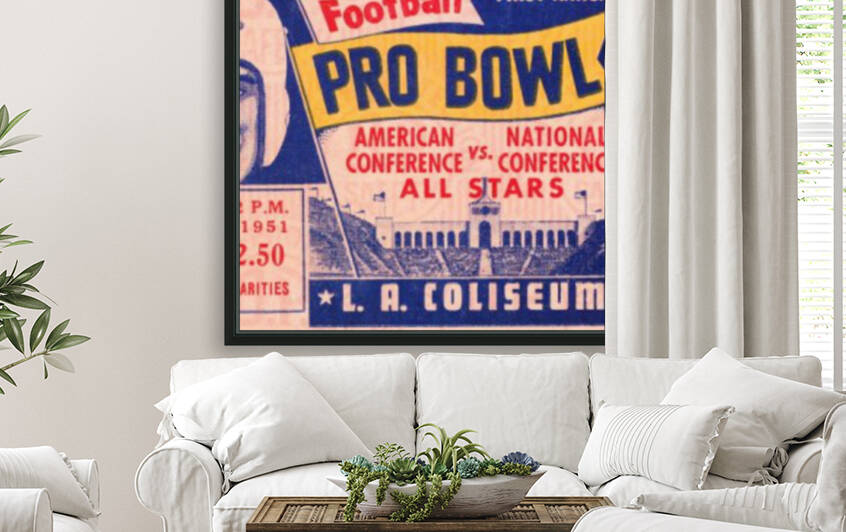
Image resolution: width=846 pixels, height=532 pixels. In order to click on coffee table in this screenshot , I will do `click(523, 519)`.